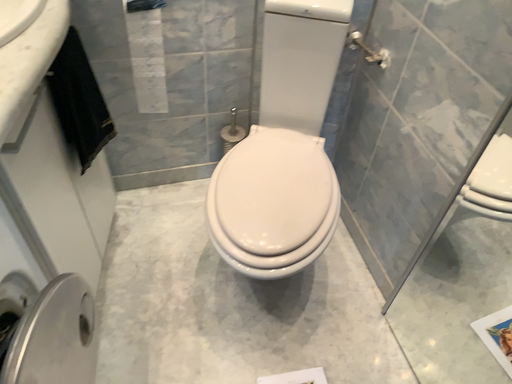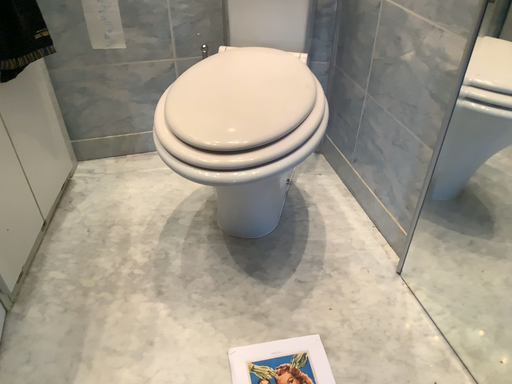
Question: Which way did the camera rotate in the video?

Choices:
 (A) rotated downward
 (B) rotated upward

Answer: (B)